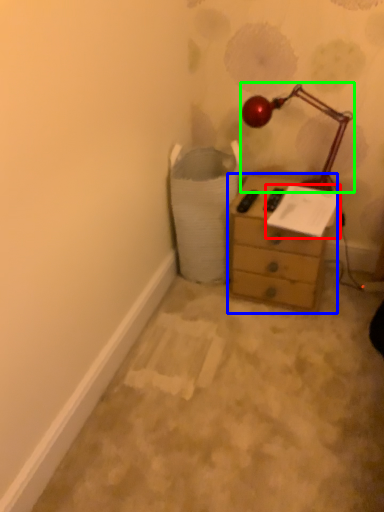
Question: Based on their relative distances, which object is nearer to paper (highlighted by a red box)? Choose from chest of drawers (highlighted by a blue box) and lamp (highlighted by a green box).

Choices:
 (A) chest of drawers
 (B) lamp

Answer: (A)